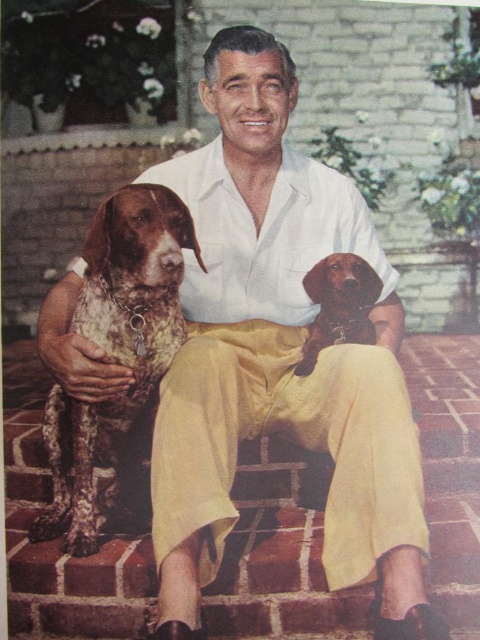
You are a photographer trying to capture the man and his dogs in the image. The speckled fur dog at left is at point (116, 348). Where is this point located on the dog?

The point (116, 348) is located on the speckled fur dog at left.

You are a photographer trying to capture a photo of the speckled fur dog at left and the smooth brown dachshund at center. Since the dachshund is shorter, where should you position your camera to ensure both dogs are visible in the frame?

To ensure both the speckled fur dog at left and the smooth brown dachshund at center are visible, position the camera at a lower angle so that the shorter dachshund isn t cropped out while still capturing the taller speckled fur dog.